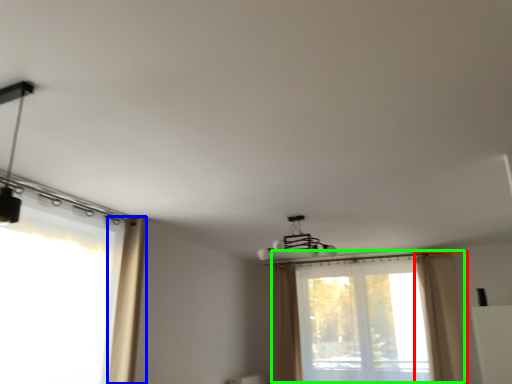
Question: Which is farther away from curtain (highlighted by a red box)? curtain (highlighted by a blue box) or window (highlighted by a green box)?

Choices:
 (A) curtain
 (B) window

Answer: (A)